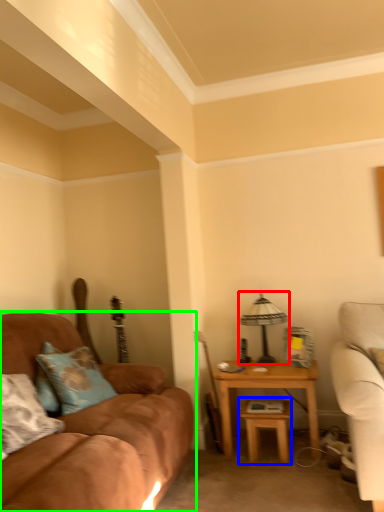
Question: Which is nearer to the table lamp (highlighted by a red box)? table (highlighted by a blue box) or studio couch (highlighted by a green box).

Choices:
 (A) table
 (B) studio couch

Answer: (A)